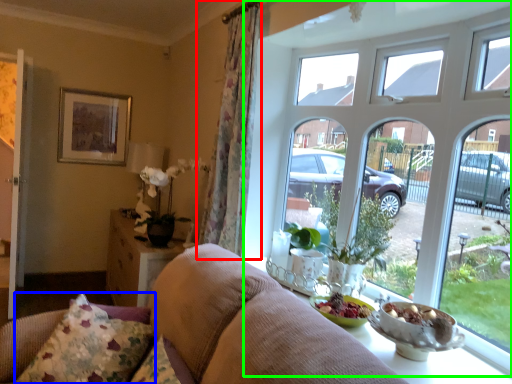
Question: Which is farther away from curtain (highlighted by a red box)? pillow (highlighted by a blue box) or window (highlighted by a green box)?

Choices:
 (A) pillow
 (B) window

Answer: (A)